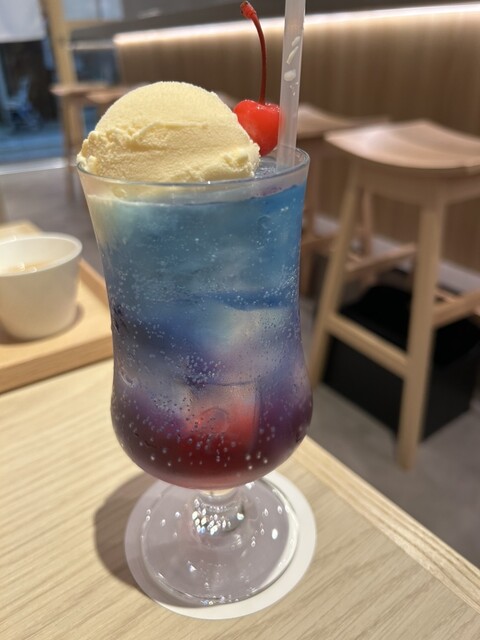
You are a GUI agent. You are given a task and a screenshot of the screen. Output one action in this format:
    pyautogui.click(x=<x>, y=<y>)
    Task: Click on the stool
    
    Given the screenshot: What is the action you would take?
    pyautogui.click(x=404, y=159), pyautogui.click(x=324, y=121)